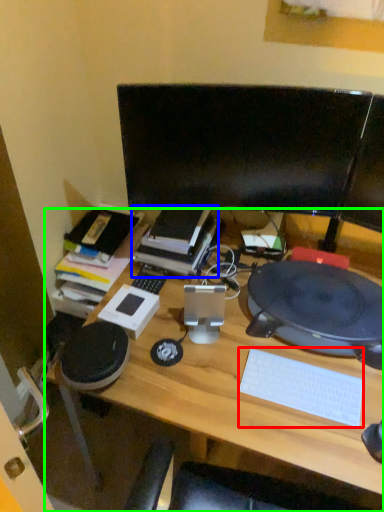
Question: Considering the real-world distances, which object is closest to computer keyboard (highlighted by a red box)? book (highlighted by a blue box) or desk (highlighted by a green box).

Choices:
 (A) book
 (B) desk

Answer: (B)